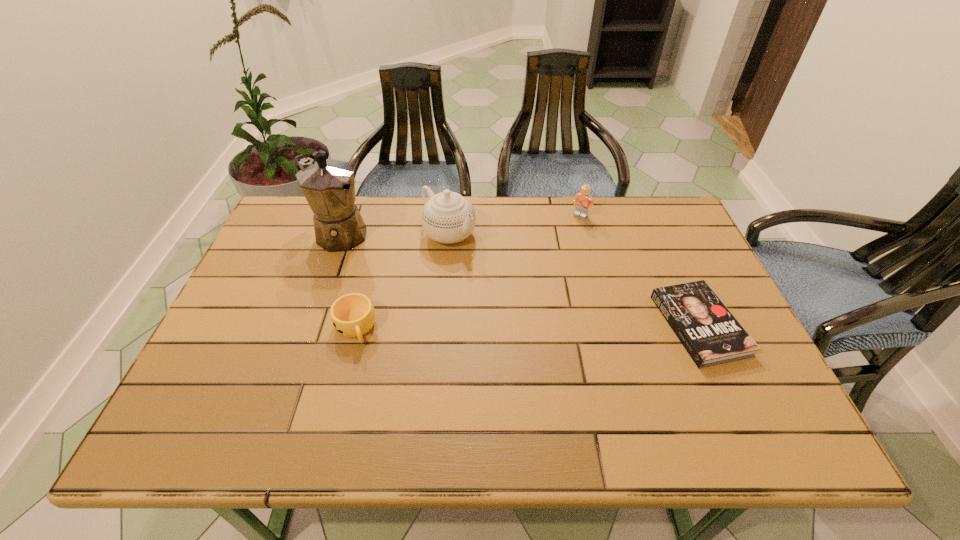
Find the location of a particular element. Image resolution: width=960 pixels, height=540 pixels. vacant space located 0.200m on the spout of the third object from right to left is located at coordinates (517, 283).

This screenshot has width=960, height=540. In order to click on free space located 0.150m on the spout of the third object from right to left in this screenshot , I will do (x=504, y=273).

The width and height of the screenshot is (960, 540). Identify the location of free space located 0.180m on the spout of the third object from right to left. (512, 279).

Where is `free space located 0.370m on the front-facing side of the third tallest object`? Image resolution: width=960 pixels, height=540 pixels. free space located 0.370m on the front-facing side of the third tallest object is located at coordinates (513, 289).

The width and height of the screenshot is (960, 540). Find the location of `vacant space located on the front-facing side of the third tallest object`. vacant space located on the front-facing side of the third tallest object is located at coordinates (532, 268).

I want to click on free space located on the front-facing side of the third tallest object, so click(517, 285).

This screenshot has width=960, height=540. I want to click on vacant region located on the pouring side of the tallest object, so click(x=396, y=271).

Locate an element on the screen. free space located on the pouring side of the tallest object is located at coordinates (448, 306).

Where is `free spot located 0.280m on the pouring side of the tallest object`? free spot located 0.280m on the pouring side of the tallest object is located at coordinates tap(426, 291).

Locate an element on the screen. chinaware at the far edge is located at coordinates (447, 217).